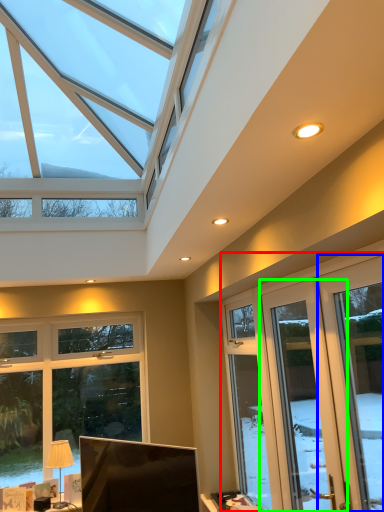
Question: Considering the real-world distances, which object is closest to screen door (highlighted by a red box)? window (highlighted by a blue box) or screen door (highlighted by a green box).

Choices:
 (A) window
 (B) screen door

Answer: (B)